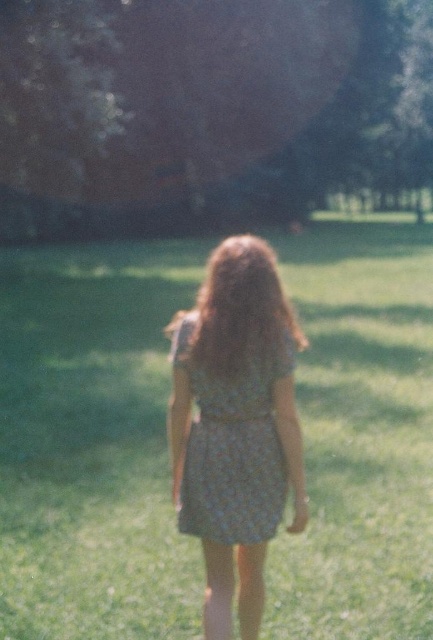
You are a photographer planning to take a closeup shot of the person in the image. The camera is currently focused on the point at coordinates point (91, 444). What is the subject at that point, and how might this affect your portrait?

The point (91, 444) indicates green textured grass at center. This means the current focus is on the grass in the center, which could blur the person slightly in the background, so adjusting the focus to the person would ensure their features are sharp.

You are a photographer adjusting your camera settings to capture the scene. You notice two points in the image at coordinates point (219, 436) and point (216, 308). Which point is closer to the camera lens?

Point (219, 436) is further to the viewer than point (216, 308), so the point closer to the camera lens is point (216, 308).